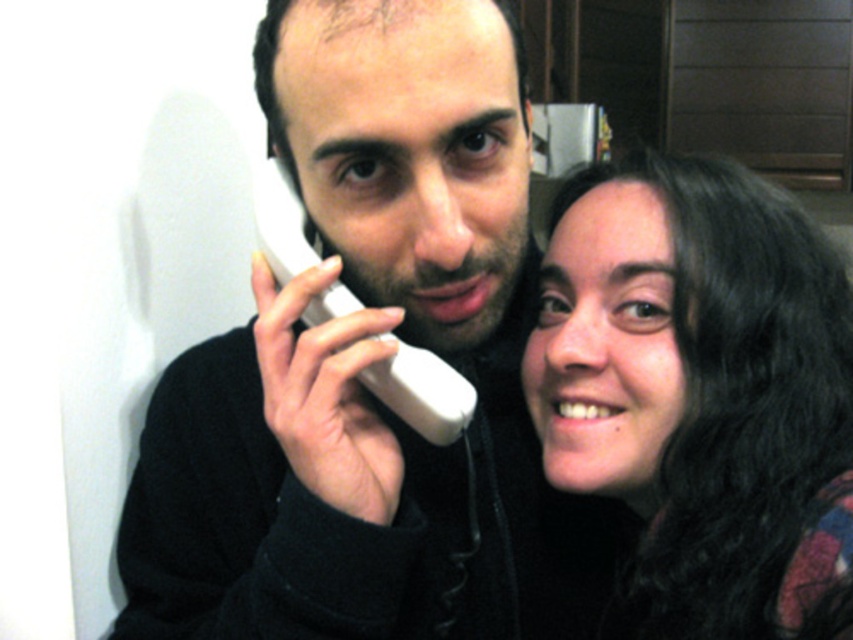
Who is taller, smooth dark hair at right or white plastic phone at center?

With more height is smooth dark hair at right.

Can you confirm if smooth dark hair at right is wider than white plastic phone at center?

Yes, smooth dark hair at right is wider than white plastic phone at center.

This screenshot has height=640, width=853. In order to click on smooth dark hair at right in this screenshot , I will do `click(701, 394)`.

At what (x,y) coordinates should I click in order to perform the action: click on smooth dark hair at right. Please return your answer as a coordinate pair (x, y). The image size is (853, 640). Looking at the image, I should click on (701, 394).